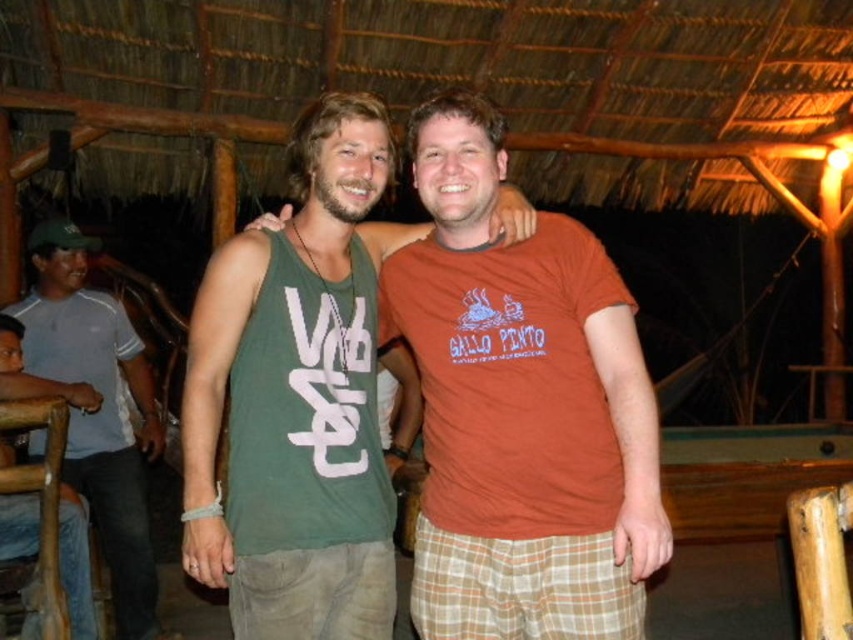
Between point (364, 96) and point (117, 624), which one is positioned behind?

Point (117, 624)

The image size is (853, 640). Find the location of `green cotton tank top at center`. green cotton tank top at center is located at coordinates (297, 397).

Who is more forward, (x=131, y=545) or (x=24, y=524)?

Point (x=24, y=524) is more forward.

Is point (102, 368) less distant than point (7, 326)?

No, it is not.

Which is in front, point (103, 545) or point (80, 625)?

Positioned in front is point (80, 625).

The height and width of the screenshot is (640, 853). I want to click on gray cotton shirt at left, so click(97, 410).

What do you see at coordinates (297, 397) in the screenshot?
I see `green cotton tank top at center` at bounding box center [297, 397].

Consider the image. Does green cotton tank top at center lie in front of jeans at left?

Yes, it is.

This screenshot has width=853, height=640. What are the coordinates of `green cotton tank top at center` in the screenshot? It's located at (297, 397).